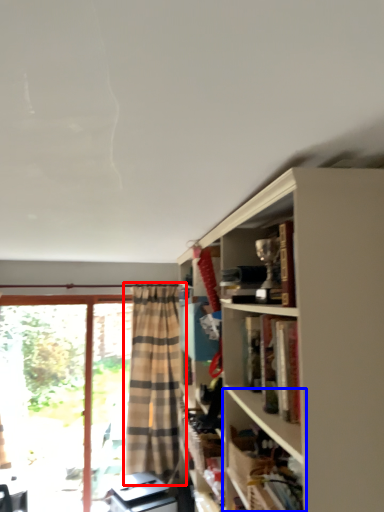
Question: Which point is closer to the camera, curtain (highlighted by a red box) or shelf (highlighted by a blue box)?

Choices:
 (A) curtain
 (B) shelf

Answer: (B)